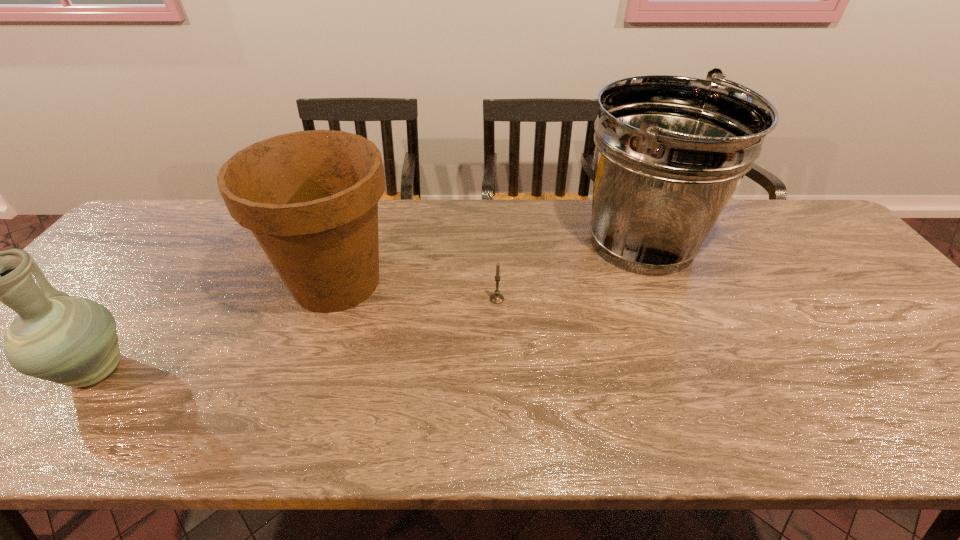
Image resolution: width=960 pixels, height=540 pixels. I want to click on free location that satisfies the following two spatial constraints: 1. on the handle side of the nearest object; 2. on the left side of the third object from right to left, so click(x=164, y=282).

The image size is (960, 540). Identify the location of free location that satisfies the following two spatial constraints: 1. on the handle side of the nearest object; 2. on the left side of the third object from right to left. (164, 282).